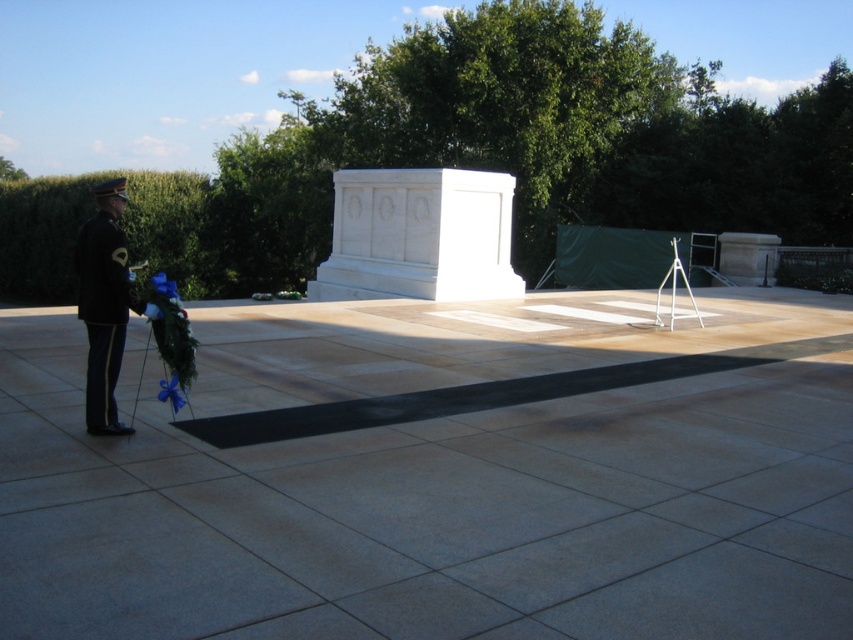
Question: Is black uniform at left smaller than blue satin ribbon at lower left?

Choices:
 (A) no
 (B) yes

Answer: (A)

Question: Does black uniform at left have a lesser width compared to blue satin ribbon at lower left?

Choices:
 (A) no
 (B) yes

Answer: (A)

Question: Does black uniform at left have a smaller size compared to blue satin ribbon at lower left?

Choices:
 (A) no
 (B) yes

Answer: (A)